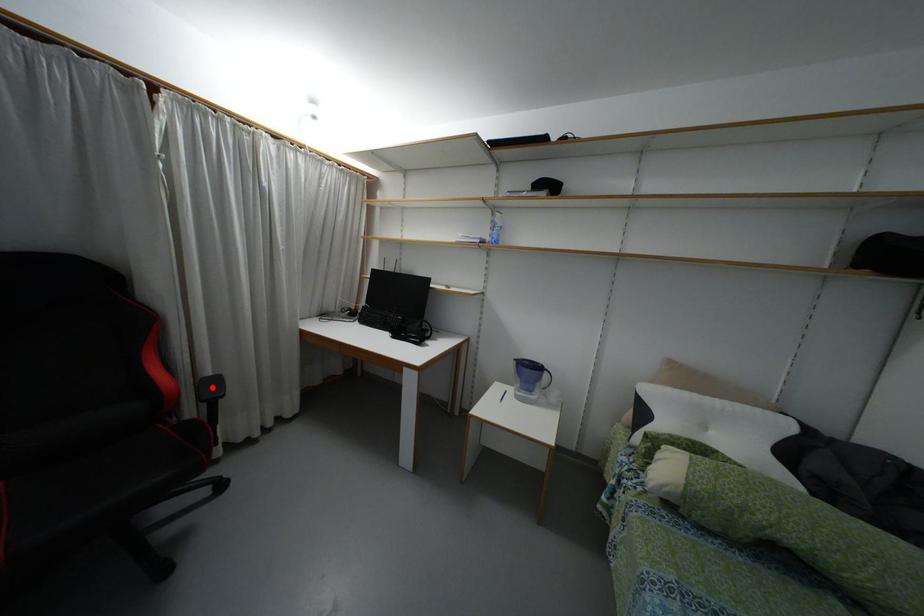
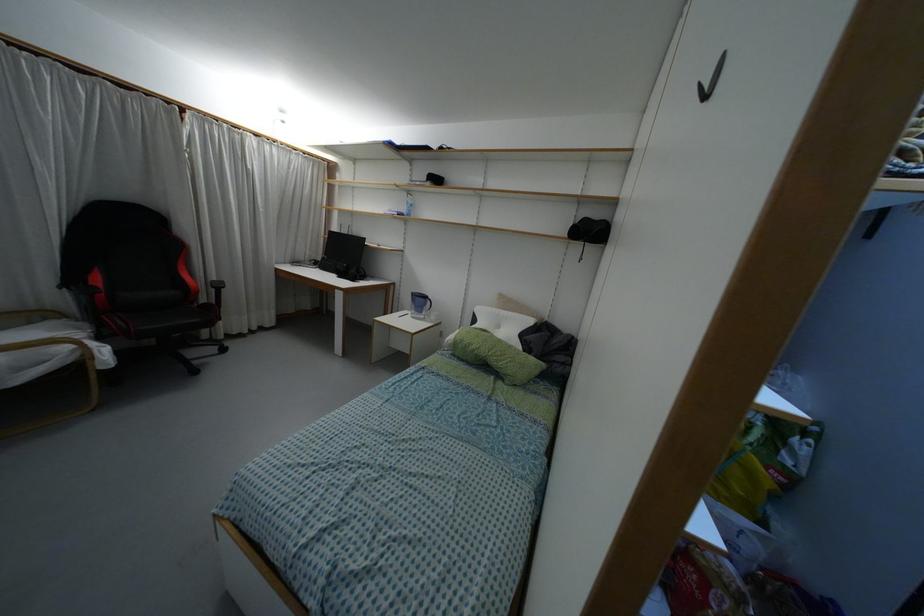
Where in the second image is the point corresponding to the highlighted location from the first image?

(217, 286)